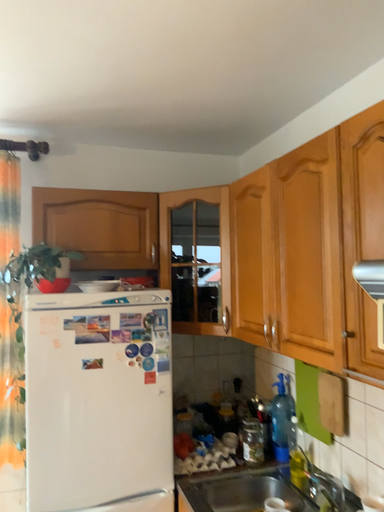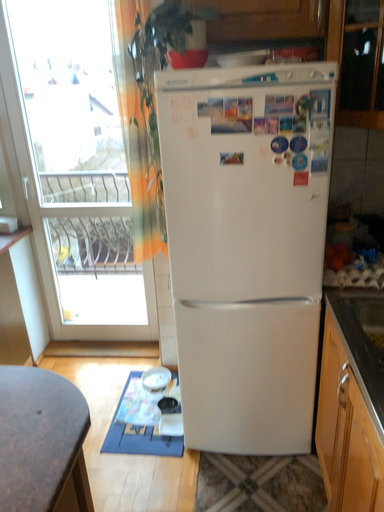
Question: Which way did the camera rotate in the video?

Choices:
 (A) rotated right
 (B) rotated left

Answer: (B)